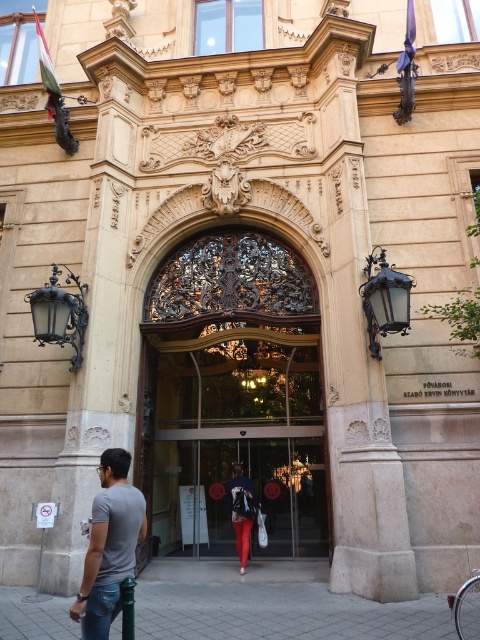
Is dark brown wrought iron door at center shorter than gray cotton t-shirt at lower left?

In fact, dark brown wrought iron door at center may be taller than gray cotton t-shirt at lower left.

Can you confirm if dark brown wrought iron door at center is taller than gray cotton t-shirt at lower left?

Indeed, dark brown wrought iron door at center has a greater height compared to gray cotton t-shirt at lower left.

Is point (177, 465) closer to camera compared to point (84, 630)?

No, it is not.

Image resolution: width=480 pixels, height=640 pixels. I want to click on dark brown wrought iron door at center, so click(x=231, y=396).

Who is higher up, dark brown wrought iron door at center or matte black backpack at center?

Positioned higher is dark brown wrought iron door at center.

Which is more to the right, dark brown wrought iron door at center or matte black backpack at center?

matte black backpack at center

I want to click on dark brown wrought iron door at center, so click(x=231, y=396).

Which is more to the left, beige stone pillar at center or matte black backpack at center?

beige stone pillar at center

Can you confirm if beige stone pillar at center is bigger than matte black backpack at center?

Yes.

Find the location of a particular element. This screenshot has height=640, width=480. beige stone pillar at center is located at coordinates (x=98, y=332).